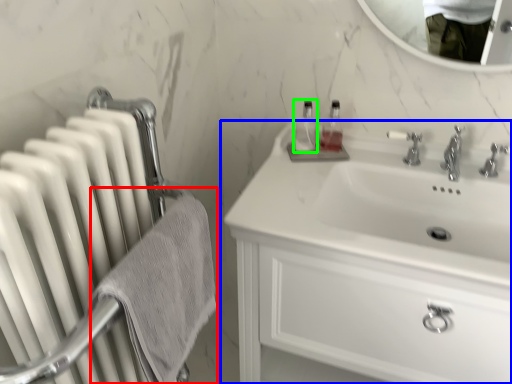
Question: Which object is positioned farthest from bath towel (highlighted by a red box)? Select from bathroom cabinet (highlighted by a blue box) and bottle (highlighted by a green box).

Choices:
 (A) bathroom cabinet
 (B) bottle

Answer: (B)